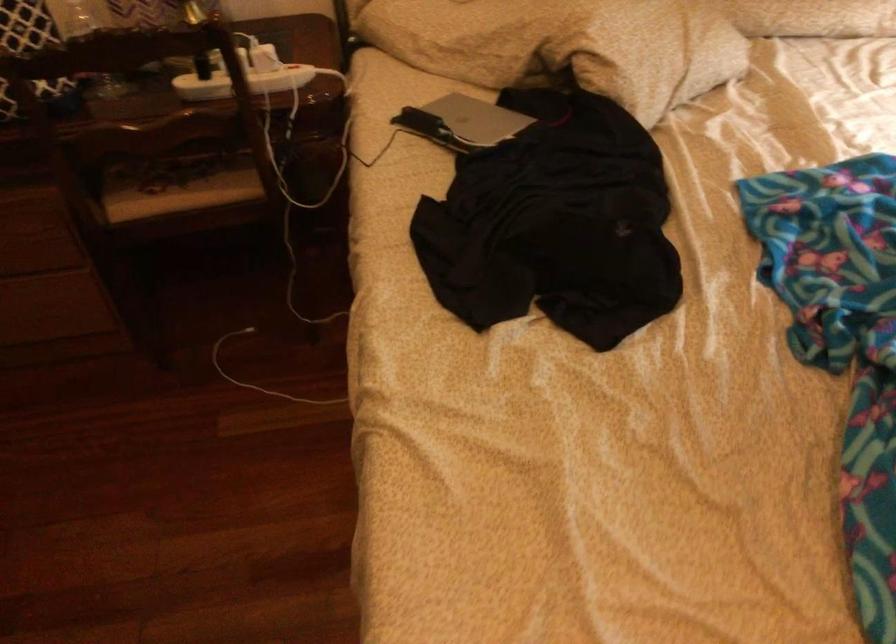
The image size is (896, 644). Identify the location of white power strip. (243, 82).